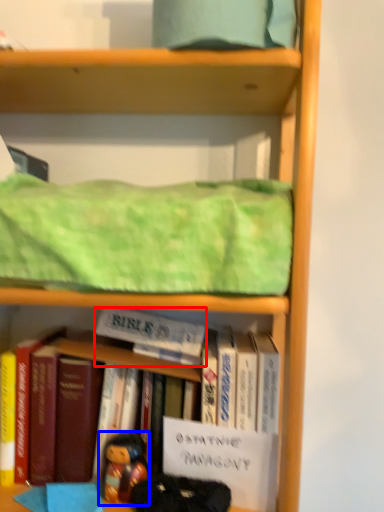
Question: Which object is closer to the camera taking this photo, paperback book (highlighted by a red box) or person (highlighted by a blue box)?

Choices:
 (A) paperback book
 (B) person

Answer: (B)